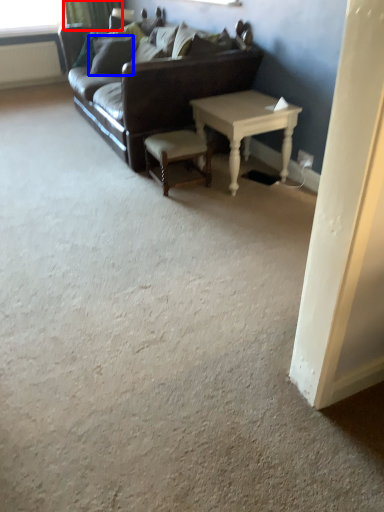
Question: Which object is closer to the camera taking this photo, curtain (highlighted by a red box) or pillow (highlighted by a blue box)?

Choices:
 (A) curtain
 (B) pillow

Answer: (B)